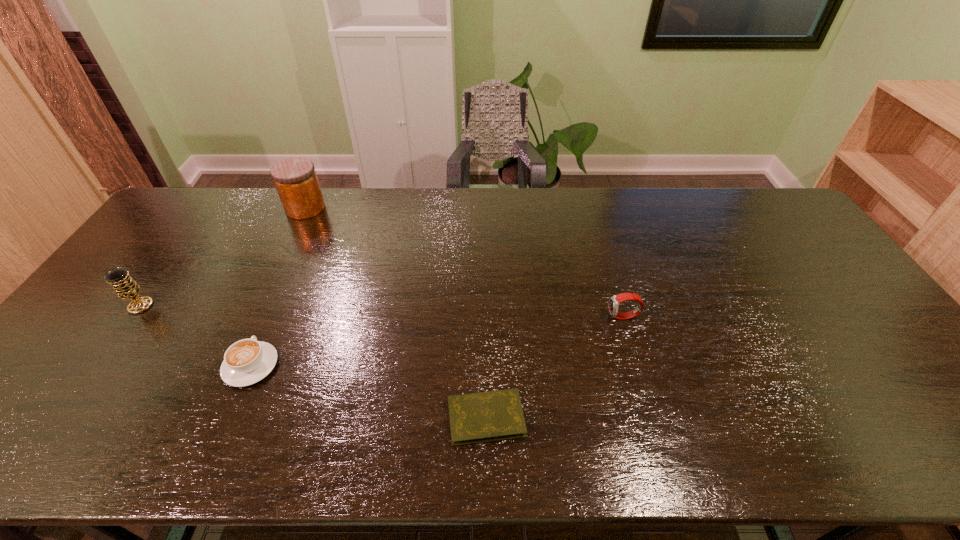
What are the coordinates of `free point between the leftmost object and the third shortest object` in the screenshot? It's located at (382, 312).

Locate an element on the screen. free space between the third shortest object and the farthest object is located at coordinates point(465,263).

Locate an element on the screen. vacant space that's between the leftmost object and the fourth object from left to right is located at coordinates (313, 362).

Image resolution: width=960 pixels, height=540 pixels. Find the location of `free space that is in between the fourth shortest object and the second shortest object`. free space that is in between the fourth shortest object and the second shortest object is located at coordinates (196, 336).

The width and height of the screenshot is (960, 540). In order to click on empty location between the rightmost object and the chalice in this screenshot , I will do [382, 312].

In order to click on free spot between the diary and the rightmost object in this screenshot , I will do `click(555, 367)`.

Locate an element on the screen. Image resolution: width=960 pixels, height=540 pixels. vacant space in between the second nearest object and the jar is located at coordinates (278, 287).

Locate an element on the screen. This screenshot has width=960, height=540. unoccupied position between the second nearest object and the shortest object is located at coordinates (369, 392).

The image size is (960, 540). I want to click on object that stands as the second closest to the jar, so click(x=247, y=361).

Choose which object is the second nearest neighbor to the nearest object. Please provide its 2D coordinates. Your answer should be formatted as a tuple, i.e. [(x, y)], where the tuple contains the x and y coordinates of a point satisfying the conditions above.

[(247, 361)]